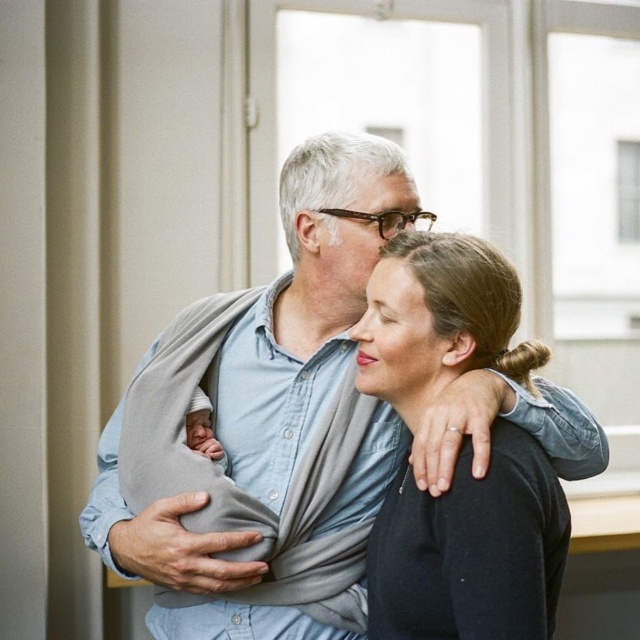
Question: Which point is farther to the camera?

Choices:
 (A) (467, 337)
 (B) (387, 419)

Answer: (B)

Question: Can you confirm if gray fabric baby carrier at center is positioned to the left of black matte hair at center?

Choices:
 (A) no
 (B) yes

Answer: (B)

Question: Among these points, which one is nearest to the camera?

Choices:
 (A) (x=408, y=180)
 (B) (x=380, y=348)

Answer: (B)

Question: Is gray fabric baby carrier at center to the right of black matte hair at center from the viewer's perspective?

Choices:
 (A) yes
 (B) no

Answer: (B)

Question: Can you confirm if gray fabric baby carrier at center is positioned to the right of black matte hair at center?

Choices:
 (A) no
 (B) yes

Answer: (A)